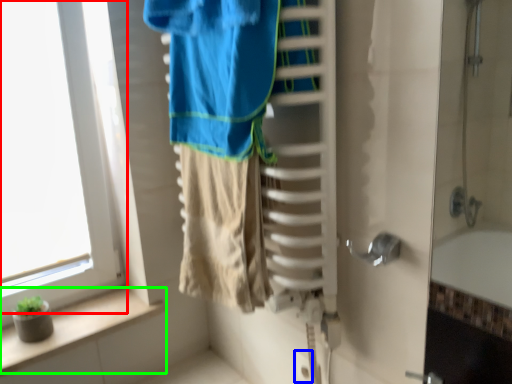
Question: Based on their relative distances, which object is nearer to window (highlighted by a red box)? Choose from electric outlet (highlighted by a blue box) and balustrade (highlighted by a green box).

Choices:
 (A) electric outlet
 (B) balustrade

Answer: (B)